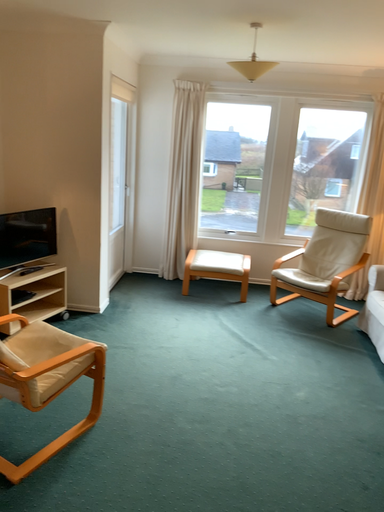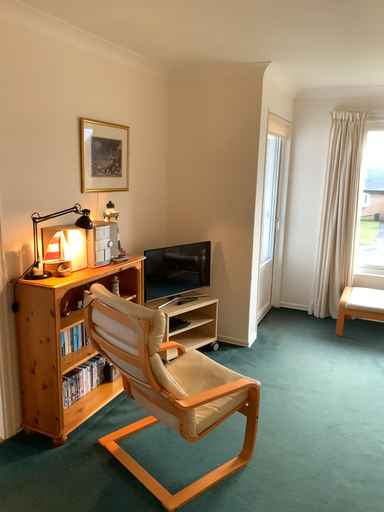
Question: How did the camera likely rotate when shooting the video?

Choices:
 (A) rotated right
 (B) rotated left

Answer: (B)